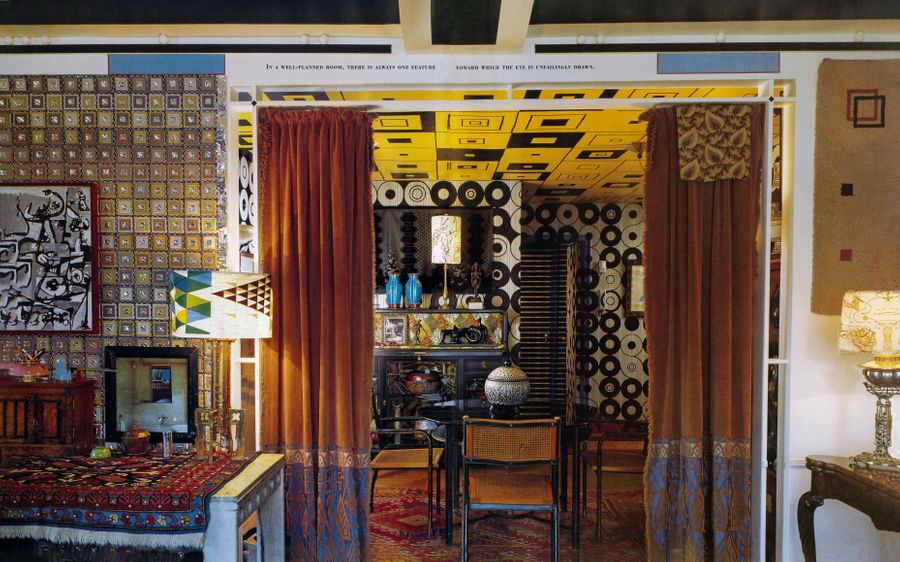
Locate an element on the screen. This screenshot has width=900, height=562. white wall is located at coordinates (833, 419), (835, 537).